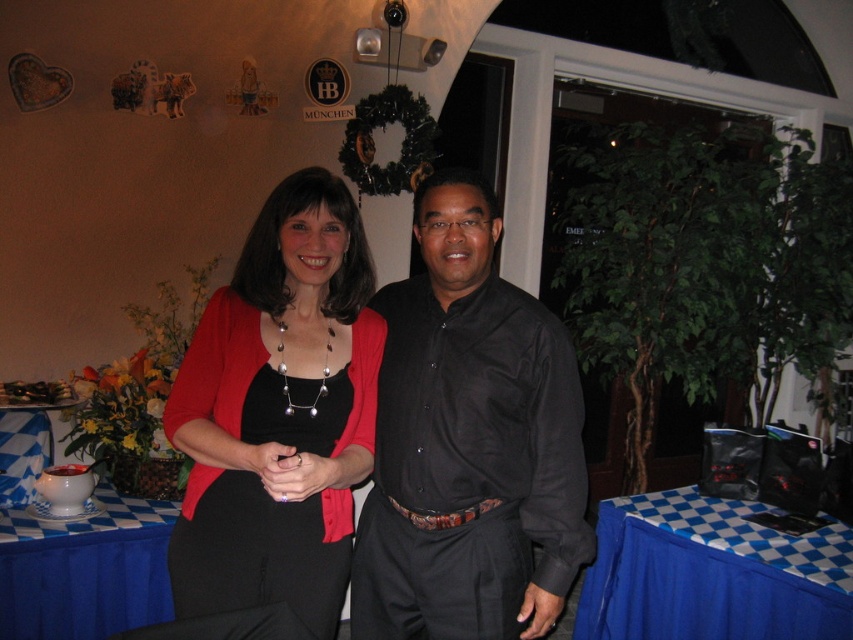
Based on the photo, you are a photographer standing at the point marked as point (314, 600). You want to take a photo of the two people in the foreground. Can you fit both of them in your camera frame if your camera has a 1.5 meter wide field of view?

The two people in the foreground are 1.59 meters apart. Since your camera has a 1.5 meter wide field of view, which is slightly narrower than the distance between them, you cannot fit both of them in the frame at the same time.

You are a photographer at this event and need to capture a photo that includes both the black satin dress at center and the white ceramic bowl at lower left. Based on their positions, will the bowl be visible in the frame if you focus on the dress?

The black satin dress at center is above the white ceramic bowl at lower left, so if you focus on the dress, the bowl will still be visible in the frame below it.

You are at the gathering and want to take a photo of the scene. The camera you have can only focus on objects within 5 feet. Is the point at coordinate point (202, 397) within the camera focus range?

The point (202, 397) is 5.10 feet away from the camera, which is just beyond the 5 feet focus range. Therefore, the camera cannot focus on that point.